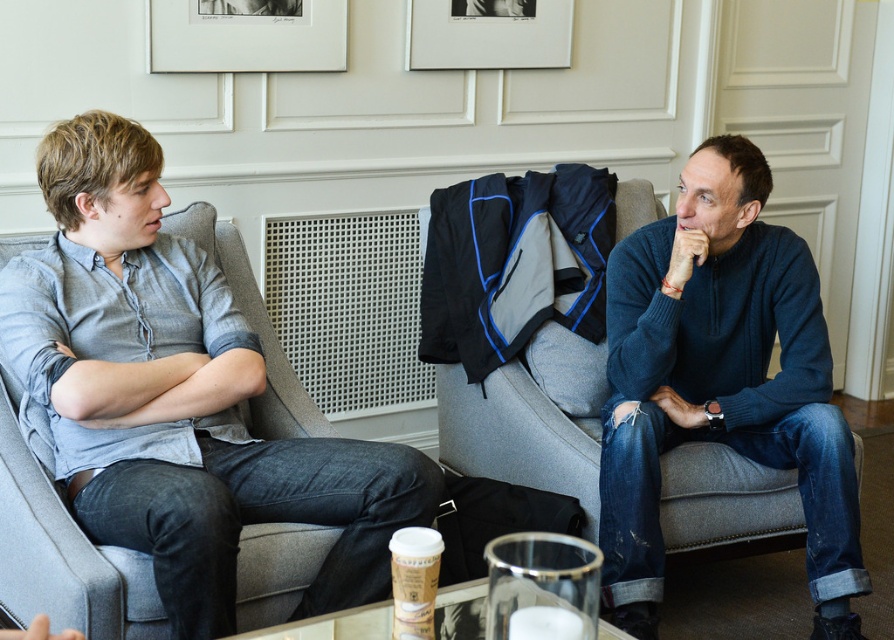
Is dark blue sweater at right to the left of matte white picture frame at upper center from the viewer's perspective?

No, dark blue sweater at right is not to the left of matte white picture frame at upper center.

Is dark blue sweater at right above matte white picture frame at upper center?

Actually, dark blue sweater at right is below matte white picture frame at upper center.

Describe the element at coordinates (721, 381) in the screenshot. I see `dark blue sweater at right` at that location.

Locate an element on the screen. The height and width of the screenshot is (640, 894). dark blue sweater at right is located at coordinates [x=721, y=381].

Which is in front, point (204, 518) or point (222, 52)?

Positioned in front is point (204, 518).

Which is behind, point (133, 456) or point (256, 20)?

Point (256, 20)

Identify the location of light gray shirt at left. The width and height of the screenshot is (894, 640). (178, 396).

Is light gray shirt at left positioned behind dark blue sweater at right?

No, light gray shirt at left is closer to the viewer.

Which is more to the right, light gray shirt at left or dark blue sweater at right?

Positioned to the right is dark blue sweater at right.

Between point (235, 326) and point (719, 170), which one is positioned behind?

Positioned behind is point (719, 170).

The image size is (894, 640). Identify the location of light gray shirt at left. (178, 396).